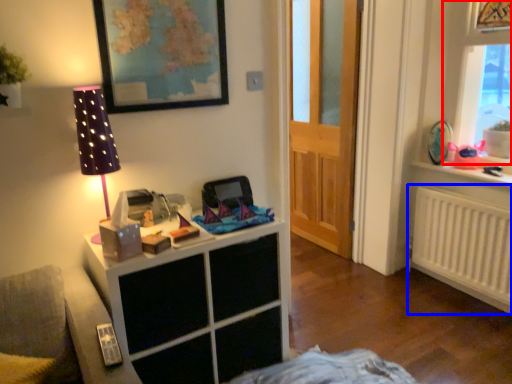
Question: Which object is closer to the camera taking this photo, window (highlighted by a red box) or radiator (highlighted by a blue box)?

Choices:
 (A) window
 (B) radiator

Answer: (A)